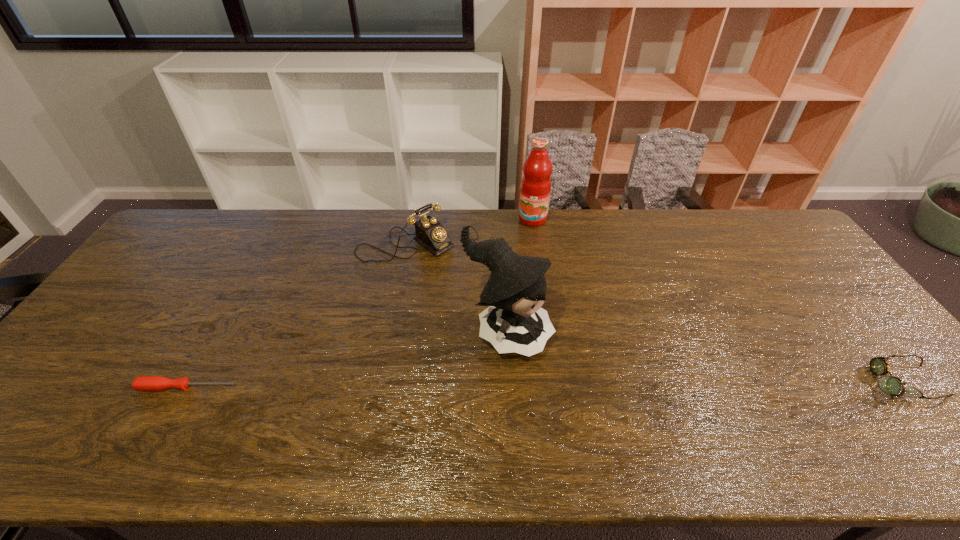
Locate an element on the screen. free space on the desktop that is between the screwdriver and the spectacles and is positioned at the face of the doll is located at coordinates (592, 384).

Locate an element on the screen. free space on the desktop that is between the screwdriver and the spectacles and is positioned on the front label of the farthest object is located at coordinates (473, 385).

The width and height of the screenshot is (960, 540). In order to click on free space on the desktop that is between the shortest object and the second shortest object and is positioned on the dial of the third tallest object in this screenshot , I will do `click(584, 384)`.